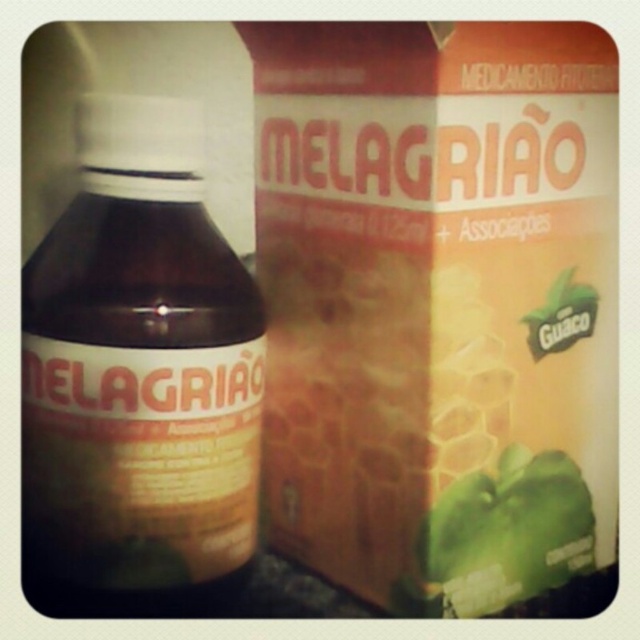
You are a delivery person who needs to place a new item between the two points, point (236, 589) and point (564, 492). Which point should you place it closer to in order to keep it within the visible area of the image?

You should place the new item closer to point (236, 589) because it is closer to the camera than point (564, 492), ensuring it stays within the visible area of the image.

You are holding a camera and want to take a closeup shot of the matte brown box at center. The camera requires the subject to be at least 18 inches away to focus properly. Can you take the photo without moving closer than the current distance?

The matte brown box at center is currently 18.24 inches away from the camera, which meets the minimum focusing distance requirement of 18 inches. Therefore, you can take the closeup shot without moving closer.

You are a pharmacist organizing a shelf. You have a matte brown box at center and a brown glass bottle at left. Which one should you place on the higher shelf if you want to avoid stacking smaller items below larger ones?

The matte brown box at center is larger in size than the brown glass bottle at left, so you should place the matte brown box at center on the higher shelf to avoid stacking smaller items below larger ones.